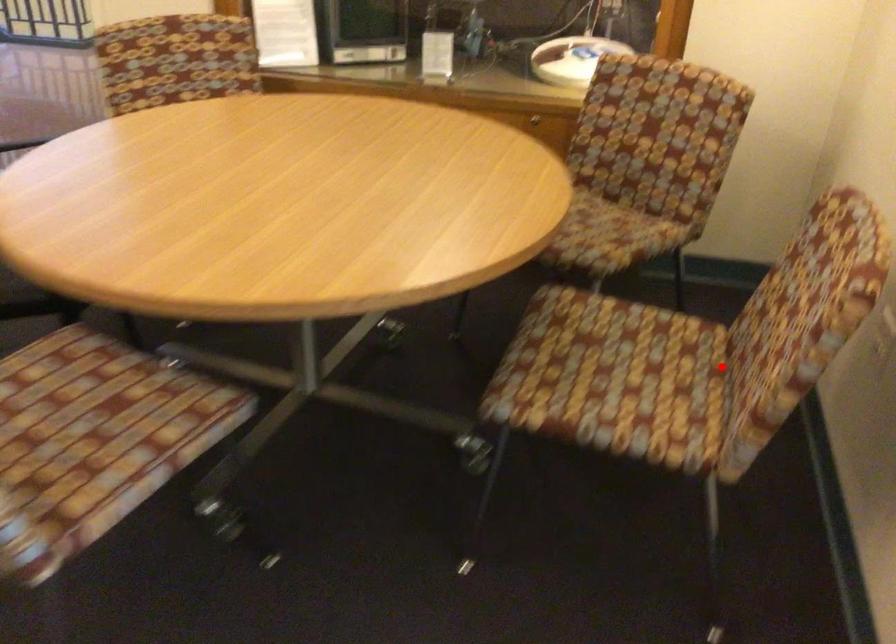
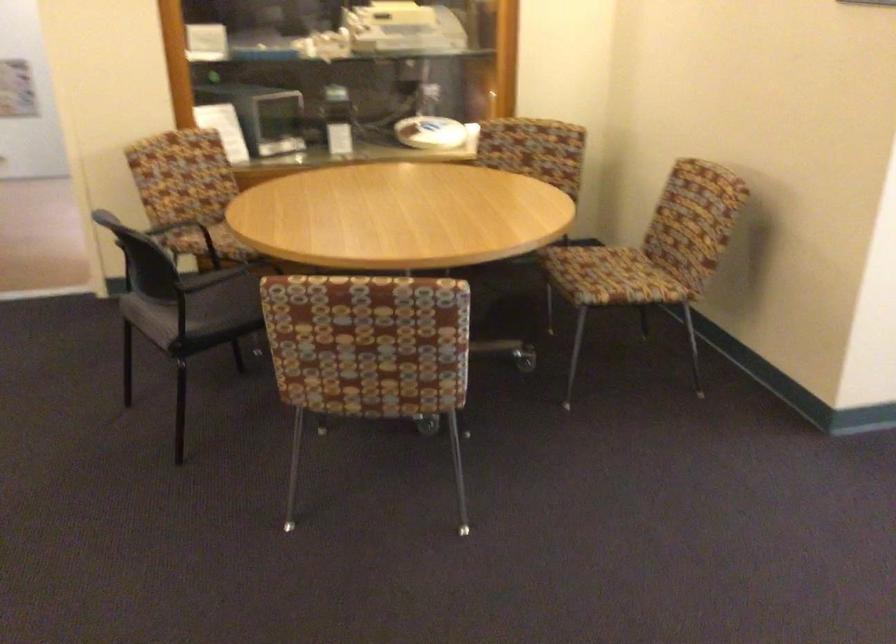
Question: A red point is marked in image1. In image2, is the corresponding 3D point closer to the camera or farther? Reply with the corresponding letter.

Choices:
 (A) The corresponding 3D point is closer.
 (B) The corresponding 3D point is farther.

Answer: (B)